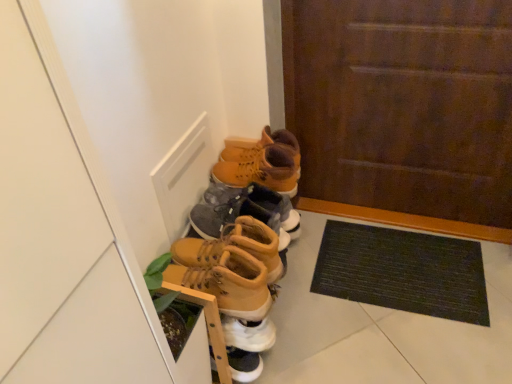
Find the location of a particular element. free point above black rubber doormat at lower right (from a real-world perspective) is located at coordinates (399, 264).